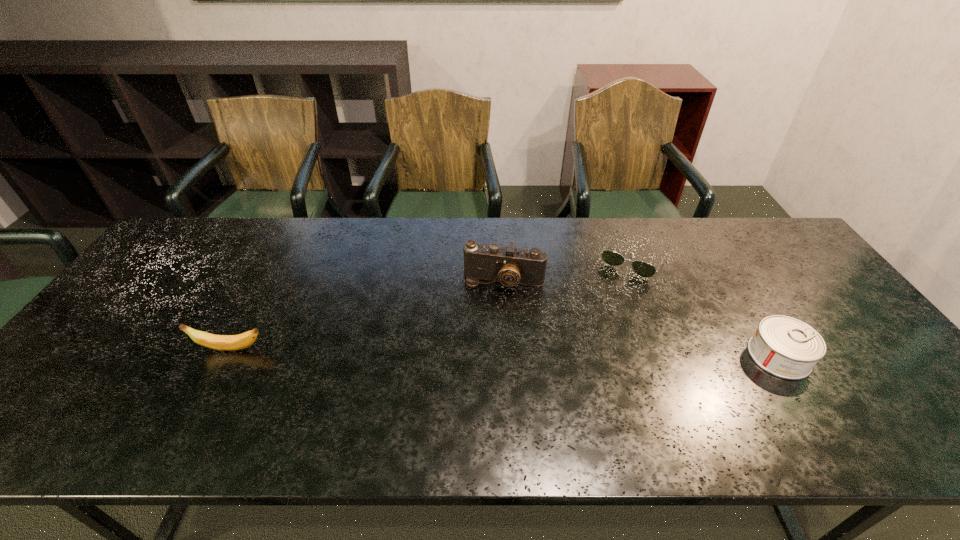
Find the location of a particular element. The width and height of the screenshot is (960, 540). free region located at the stem of the leftmost object is located at coordinates (143, 349).

Find the location of a particular element. free space located 0.290m on the back of the rightmost object is located at coordinates (720, 262).

Where is `vacant region located on the front-facing side of the second object from left to right`? This screenshot has height=540, width=960. vacant region located on the front-facing side of the second object from left to right is located at coordinates (471, 404).

Locate an element on the screen. Image resolution: width=960 pixels, height=540 pixels. free space located on the front-facing side of the second object from left to right is located at coordinates (479, 372).

Where is `vacant space located 0.250m on the front-facing side of the second object from left to right`? The image size is (960, 540). vacant space located 0.250m on the front-facing side of the second object from left to right is located at coordinates (480, 365).

Identify the location of blank space located 0.160m on the front-facing side of the sunglasses. (603, 310).

The width and height of the screenshot is (960, 540). I want to click on vacant space located 0.300m on the front-facing side of the sunglasses, so click(x=583, y=345).

This screenshot has height=540, width=960. I want to click on free space located 0.350m on the front-facing side of the sunglasses, so click(575, 358).

The height and width of the screenshot is (540, 960). Find the location of `object present at the far edge`. object present at the far edge is located at coordinates (643, 269).

Locate an element on the screen. This screenshot has height=540, width=960. object situated at the near edge is located at coordinates (788, 348).